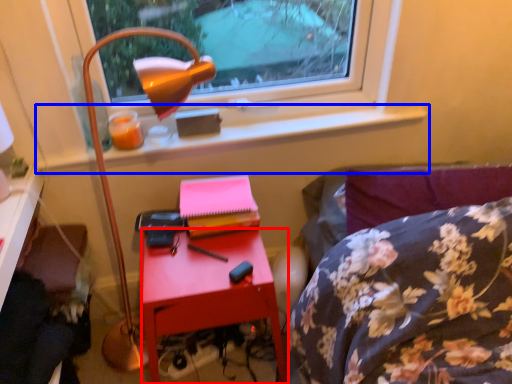
Question: Which of the following is the closest to the observer, nightstand (highlighted by a red box) or window sill (highlighted by a blue box)?

Choices:
 (A) nightstand
 (B) window sill

Answer: (A)